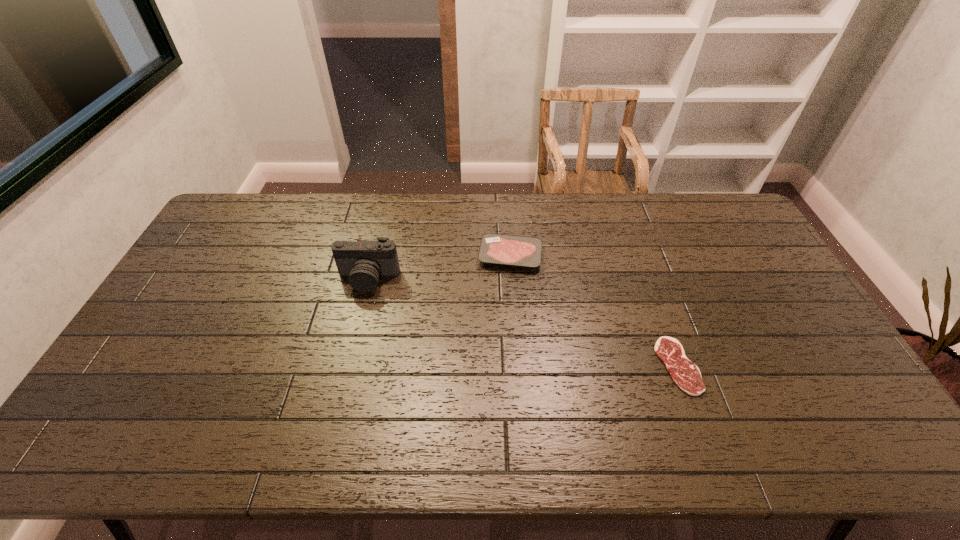
Locate an element on the screen. This screenshot has width=960, height=540. camera is located at coordinates (363, 262).

Locate an element on the screen. This screenshot has width=960, height=540. the tallest object is located at coordinates (363, 262).

Identify the location of the farther steak. (496, 249).

Find the location of a particular element. The height and width of the screenshot is (540, 960). the left steak is located at coordinates (496, 249).

Identify the location of the shortest object. (685, 374).

Where is `the nearest object`? the nearest object is located at coordinates (685, 374).

In order to click on free spot located at the lens of the tallest object in this screenshot , I will do `click(348, 364)`.

You are a GUI agent. You are given a task and a screenshot of the screen. Output one action in this format:
    pyautogui.click(x=<x>, y=<y>)
    Task: Click on the vacant space located 0.160m on the left of the second object from left to right
    The width and height of the screenshot is (960, 540).
    Given the screenshot: What is the action you would take?
    coord(430,255)

This screenshot has width=960, height=540. Find the location of `vacant space located 0.370m on the right of the shorter steak`. vacant space located 0.370m on the right of the shorter steak is located at coordinates (834, 366).

Identify the location of free space at the far edge of the desktop. (309, 217).